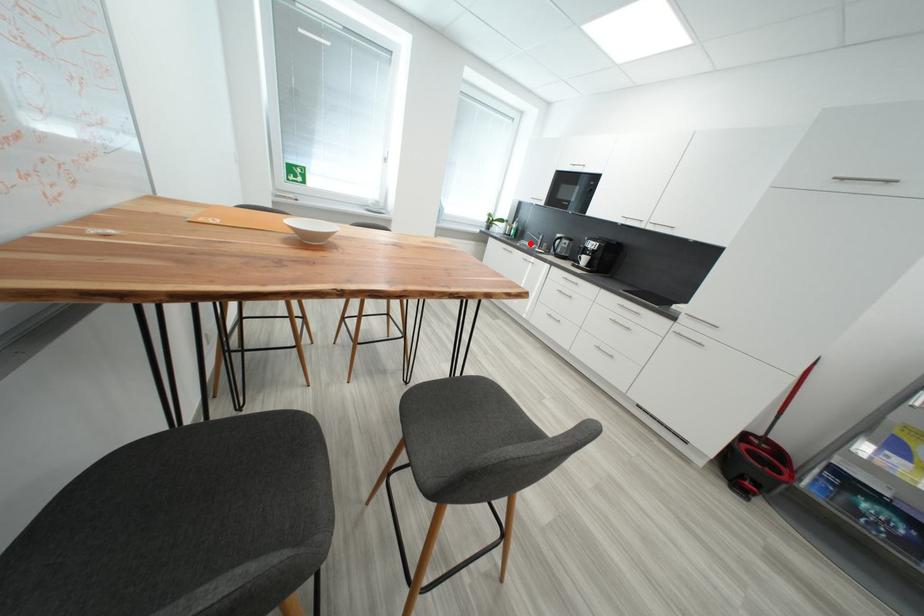
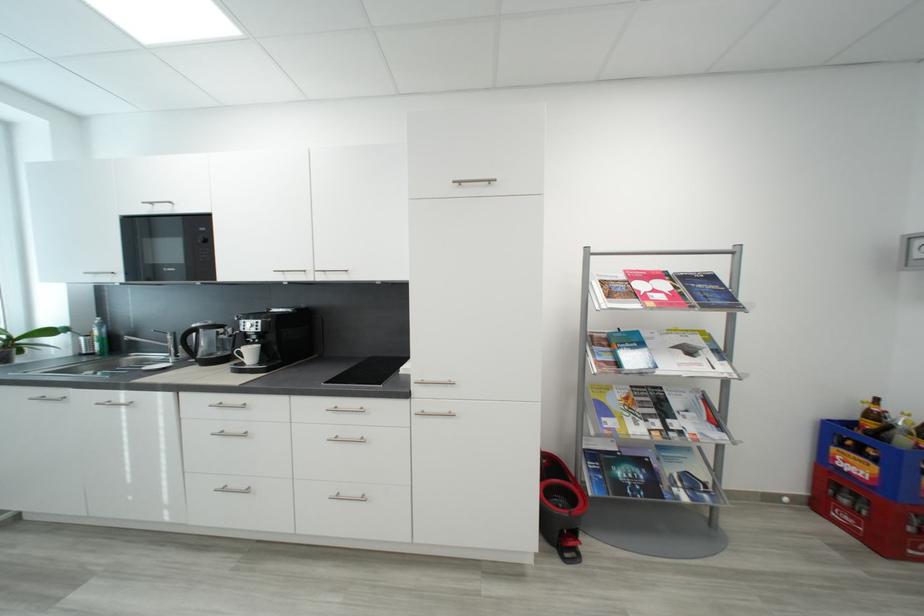
Locate, in the second image, the point that corresponds to the highlighted location in the first image.

(142, 358)